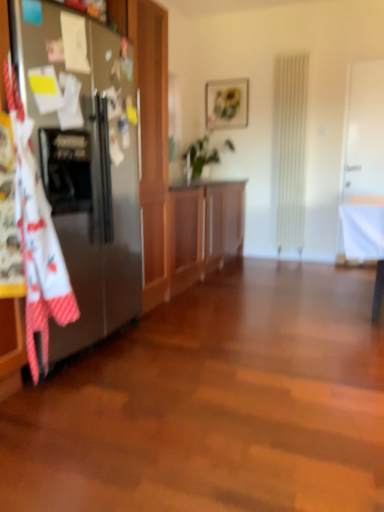
Describe the element at coordinates (84, 159) in the screenshot. I see `satin silver refrigerator at left` at that location.

The image size is (384, 512). In order to click on matte wooden picture frame at upper center in this screenshot , I will do `click(226, 103)`.

In order to face matte wooden picture frame at upper center, should I rotate leftwards or rightwards?

Rotate your view right by about 4.500°.

Find the location of a particular element. The image size is (384, 512). satin silver refrigerator at left is located at coordinates (84, 159).

Could wooden cabinet at center be considered to be inside green leafy plant at center?

That's incorrect, wooden cabinet at center is not inside green leafy plant at center.

Is green leafy plant at center next to wooden cabinet at center?

There is a gap between green leafy plant at center and wooden cabinet at center.

Does point (190, 172) come farther from viewer compared to point (187, 234)?

Yes, point (190, 172) is behind point (187, 234).

Is green leafy plant at center bigger or smaller than wooden cabinet at center?

Considering their sizes, green leafy plant at center takes up less space than wooden cabinet at center.

Can you confirm if wooden cabinet at center is bigger than satin silver refrigerator at left?

Indeed, wooden cabinet at center has a larger size compared to satin silver refrigerator at left.

Is wooden cabinet at center surrounding satin silver refrigerator at left?

Actually, satin silver refrigerator at left is outside wooden cabinet at center.

Is wooden cabinet at center looking in the opposite direction of satin silver refrigerator at left?

No, wooden cabinet at center is not facing away from satin silver refrigerator at left.

Which object is more forward, wooden cabinet at center or satin silver refrigerator at left?

Positioned in front is satin silver refrigerator at left.

Which of these two, green leafy plant at center or satin silver refrigerator at left, stands shorter?

green leafy plant at center is shorter.

In the scene shown: Is green leafy plant at center inside the boundaries of satin silver refrigerator at left, or outside?

green leafy plant at center lies outside satin silver refrigerator at left.

This screenshot has width=384, height=512. Identify the location of houseplant behind the satin silver refrigerator at left. (199, 157).

Which object is positioned more to the right, green leafy plant at center or satin silver refrigerator at left?

green leafy plant at center is more to the right.

Considering the sizes of objects matte wooden picture frame at upper center and wooden cabinet at center in the image provided, who is wider, matte wooden picture frame at upper center or wooden cabinet at center?

wooden cabinet at center is wider.

Considering the sizes of objects matte wooden picture frame at upper center and wooden cabinet at center in the image provided, who is smaller, matte wooden picture frame at upper center or wooden cabinet at center?

Smaller between the two is matte wooden picture frame at upper center.

Considering the relative positions of matte wooden picture frame at upper center and wooden cabinet at center in the image provided, is matte wooden picture frame at upper center to the left or to the right of wooden cabinet at center?

Based on their positions, matte wooden picture frame at upper center is located to the right of wooden cabinet at center.

From the image's perspective, which one is positioned higher, matte wooden picture frame at upper center or wooden cabinet at center?

matte wooden picture frame at upper center.

Based on the photo, does satin silver refrigerator at left come behind green leafy plant at center?

No, satin silver refrigerator at left is closer to the viewer.

In terms of height, does satin silver refrigerator at left look taller or shorter compared to green leafy plant at center?

Considering their sizes, satin silver refrigerator at left has more height than green leafy plant at center.

From a real-world perspective, is satin silver refrigerator at left positioned above or below green leafy plant at center?

Clearly, from a real-world perspective, satin silver refrigerator at left is below green leafy plant at center.

The height and width of the screenshot is (512, 384). In order to click on houseplant above the wooden cabinet at center (from the image's perspective) in this screenshot , I will do `click(199, 157)`.

Is point (225, 200) positioned behind point (197, 175)?

No, (225, 200) is closer to viewer.

From a real-world perspective, is green leafy plant at center positioned above or below matte wooden picture frame at upper center?

In terms of real-world spatial position, green leafy plant at center is below matte wooden picture frame at upper center.

Is green leafy plant at center next to matte wooden picture frame at upper center and touching it?

There is a gap between green leafy plant at center and matte wooden picture frame at upper center.

The height and width of the screenshot is (512, 384). In order to click on cabinetry on the left of green leafy plant at center in this screenshot , I will do `click(204, 229)`.

You are a GUI agent. You are given a task and a screenshot of the screen. Output one action in this format:
    pyautogui.click(x=<x>, y=<y>)
    Task: Click on the cabinetry directly beneath the satin silver refrigerator at left (from a real-world perspective)
    This screenshot has height=512, width=384.
    Given the screenshot: What is the action you would take?
    pyautogui.click(x=204, y=229)

Estimate the real-world distances between objects in this image. Which object is further from satin silver refrigerator at left, green leafy plant at center or matte wooden picture frame at upper center?

matte wooden picture frame at upper center is positioned further to the anchor satin silver refrigerator at left.

Looking at the image, which one is located closer to green leafy plant at center, matte wooden picture frame at upper center or wooden cabinet at center?

wooden cabinet at center.

From the image, which object appears to be farther from wooden cabinet at center, green leafy plant at center or matte wooden picture frame at upper center?

matte wooden picture frame at upper center.

Considering their positions, is wooden cabinet at center positioned further to green leafy plant at center than satin silver refrigerator at left?

satin silver refrigerator at left.

From the picture: When comparing their distances from satin silver refrigerator at left, does wooden cabinet at center or matte wooden picture frame at upper center seem further?

Based on the image, matte wooden picture frame at upper center appears to be further to satin silver refrigerator at left.

Based on their spatial positions, is matte wooden picture frame at upper center or green leafy plant at center further from wooden cabinet at center?

The object further to wooden cabinet at center is matte wooden picture frame at upper center.

Estimate the real-world distances between objects in this image. Which object is further from matte wooden picture frame at upper center, wooden cabinet at center or satin silver refrigerator at left?

Among the two, satin silver refrigerator at left is located further to matte wooden picture frame at upper center.

When comparing their distances from wooden cabinet at center, does green leafy plant at center or satin silver refrigerator at left seem further?

The object further to wooden cabinet at center is satin silver refrigerator at left.

Find the location of a particular element. houseplant between satin silver refrigerator at left and matte wooden picture frame at upper center along the z-axis is located at coordinates (199, 157).

Find the location of a particular element. houseplant between wooden cabinet at center and matte wooden picture frame at upper center from front to back is located at coordinates (199, 157).

What are the coordinates of `cabinetry positioned between satin silver refrigerator at left and green leafy plant at center from near to far` in the screenshot? It's located at (204, 229).

Where is `cabinetry located between satin silver refrigerator at left and matte wooden picture frame at upper center in the depth direction`? cabinetry located between satin silver refrigerator at left and matte wooden picture frame at upper center in the depth direction is located at coordinates (204, 229).